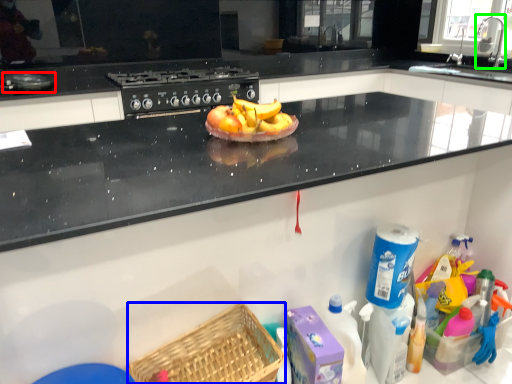
Question: Which object is positioned closest to appliance (highlighted by a red box)? Select from basket (highlighted by a blue box) and faucet (highlighted by a green box).

Choices:
 (A) basket
 (B) faucet

Answer: (A)